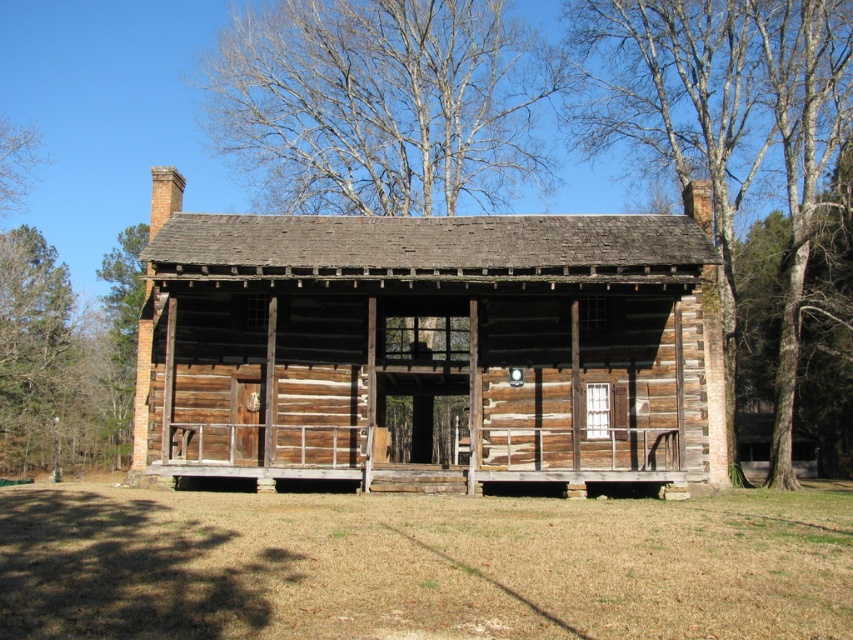
Question: Does weathered wood porch at center appear over bare branches at upper left?

Choices:
 (A) yes
 (B) no

Answer: (B)

Question: Which object is the closest to the weathered wood porch at center?

Choices:
 (A) bare branches at upper left
 (B) weathered wood log cabin at center
 (C) bare wood tree at upper center
 (D) brown rough bark tree at right

Answer: (B)

Question: Among these points, which one is nearest to the camera?

Choices:
 (A) (801, 29)
 (B) (584, 461)

Answer: (B)

Question: Which point is farther from the camera taking this photo?

Choices:
 (A) (355, 204)
 (B) (543, 268)
 (C) (350, 476)

Answer: (A)

Question: Does bare wood tree at upper center lie in front of weathered wood porch at center?

Choices:
 (A) no
 (B) yes

Answer: (A)

Question: Can you confirm if weathered wood log cabin at center is bigger than weathered wood porch at center?

Choices:
 (A) yes
 (B) no

Answer: (A)